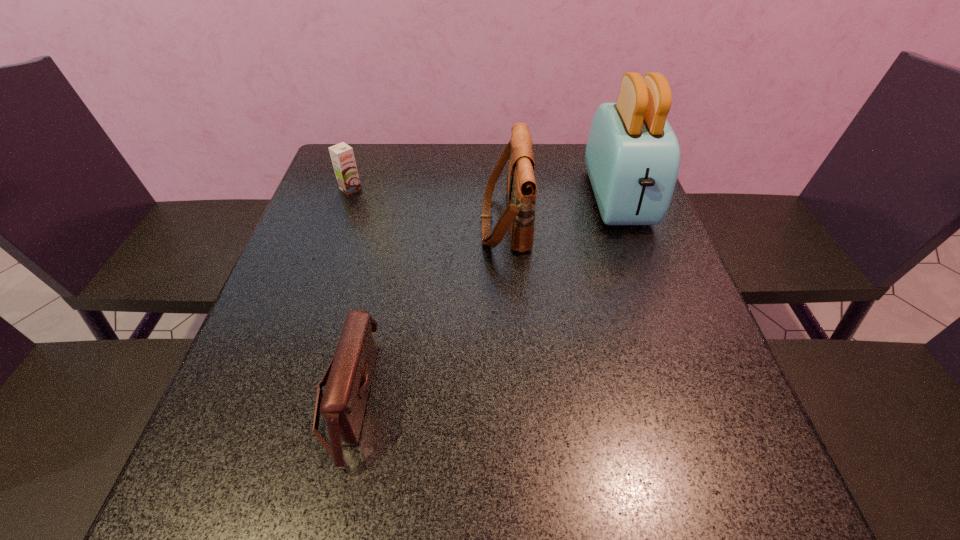
At what (x,y) coordinates should I click in order to perform the action: click on object situated at the far right corner. Please return your answer as a coordinate pair (x, y). Looking at the image, I should click on (632, 157).

The width and height of the screenshot is (960, 540). I want to click on vacant area at the far edge, so click(573, 163).

This screenshot has height=540, width=960. What are the coordinates of `vacant space at the left edge of the desktop` in the screenshot? It's located at (297, 322).

I want to click on free space at the right edge, so click(619, 305).

Image resolution: width=960 pixels, height=540 pixels. What are the coordinates of `vacant space at the near left corner of the desktop` in the screenshot? It's located at (226, 501).

Find the location of a particular element. The image size is (960, 540). blank region between the third object from left to right and the left shoulder bag is located at coordinates (426, 308).

Image resolution: width=960 pixels, height=540 pixels. What are the coordinates of `vacant space that is in between the second tallest object and the rightmost object` in the screenshot? It's located at (562, 210).

Find the location of a particular element. This screenshot has height=540, width=960. free spot between the chocolate milk and the third shortest object is located at coordinates (428, 205).

Find the location of a particular element. vacant point located between the tallest object and the farther shoulder bag is located at coordinates (562, 210).

Find the location of a particular element. The height and width of the screenshot is (540, 960). unoccupied area between the chocolate milk and the third object from left to right is located at coordinates (428, 205).